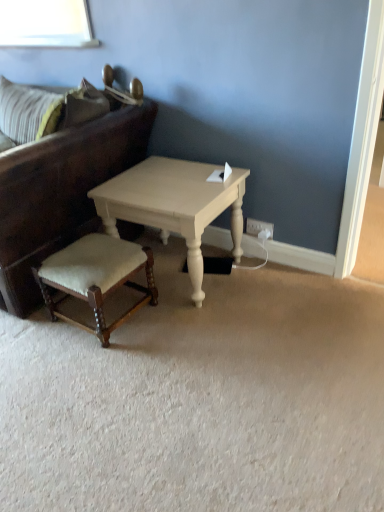
Identify the location of free space to the right of white painted wood coffee table at center. This screenshot has width=384, height=512. (271, 287).